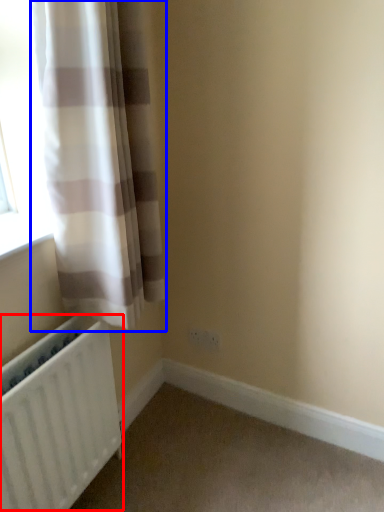
Question: Which of the following is the closest to the observer, radiator (highlighted by a red box) or curtain (highlighted by a blue box)?

Choices:
 (A) radiator
 (B) curtain

Answer: (B)